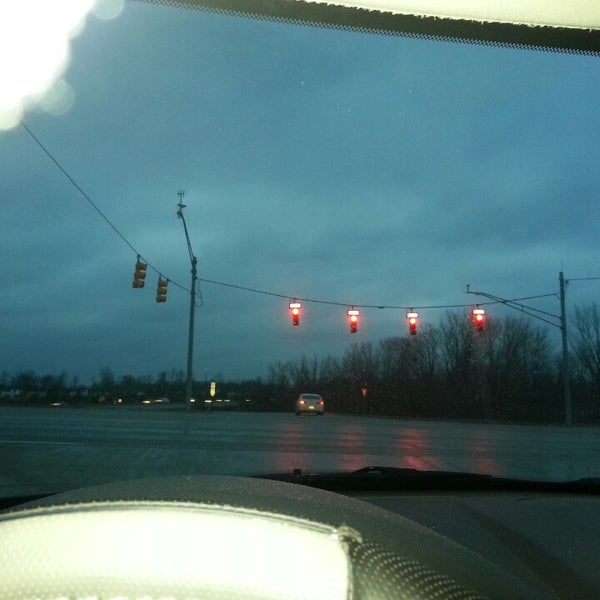
At what (x,y) coordinates should I click in order to perform the action: click on light. Please return your answer as a coordinate pair (x, y). Looking at the image, I should click on (131, 523).